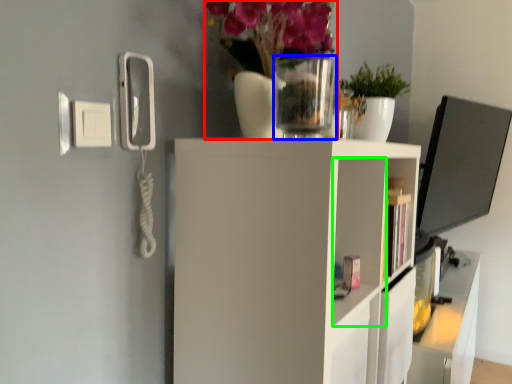
Question: Which is farther away from floral arrangement (highlighted by a red box)? glass vase (highlighted by a blue box) or cabinet (highlighted by a green box)?

Choices:
 (A) glass vase
 (B) cabinet

Answer: (B)